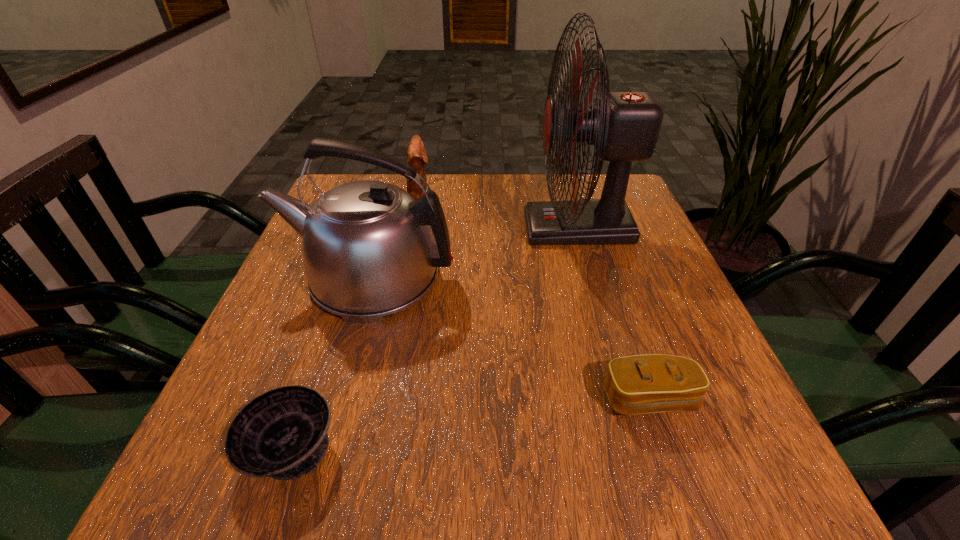
Find the location of `object that is at the near left corner`. object that is at the near left corner is located at coordinates (282, 433).

This screenshot has width=960, height=540. Find the location of `object situated at the far right corner`. object situated at the far right corner is located at coordinates (624, 126).

Identify the location of free spot at the far edge of the desktop. (497, 183).

In the image, there is a desktop. At what (x,y) coordinates should I click in order to perform the action: click on vacant space at the near edge. Please return your answer as a coordinate pair (x, y). Image resolution: width=960 pixels, height=540 pixels. Looking at the image, I should click on (496, 452).

Find the location of `free space at the left edge`. free space at the left edge is located at coordinates (282, 333).

At what (x,y) coordinates should I click in order to perform the action: click on vacant space at the right edge of the desktop. Please return your answer as a coordinate pair (x, y). The height and width of the screenshot is (540, 960). Looking at the image, I should click on (689, 298).

Identify the location of free space between the shorter clutch bag and the tallest object. (613, 313).

In order to click on vacant point located between the bowl and the kettle in this screenshot , I will do `click(331, 363)`.

Find the location of `free space between the tallest object and the bowl`. free space between the tallest object and the bowl is located at coordinates (435, 339).

The width and height of the screenshot is (960, 540). What are the coordinates of `empty location between the bowl and the fan` in the screenshot? It's located at (435, 339).